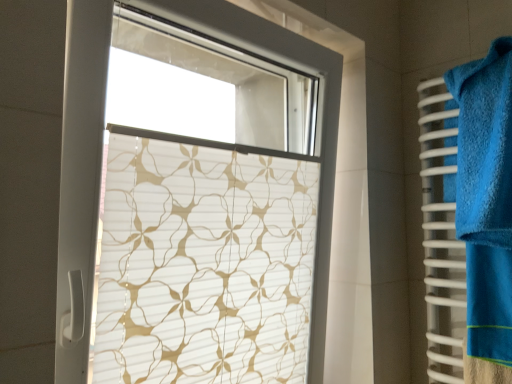
The image size is (512, 384). What do you see at coordinates (196, 203) in the screenshot? I see `translucent glass window at center` at bounding box center [196, 203].

I want to click on translucent glass window at center, so click(x=196, y=203).

Identify the location of translucent glass window at center. Image resolution: width=512 pixels, height=384 pixels. (196, 203).